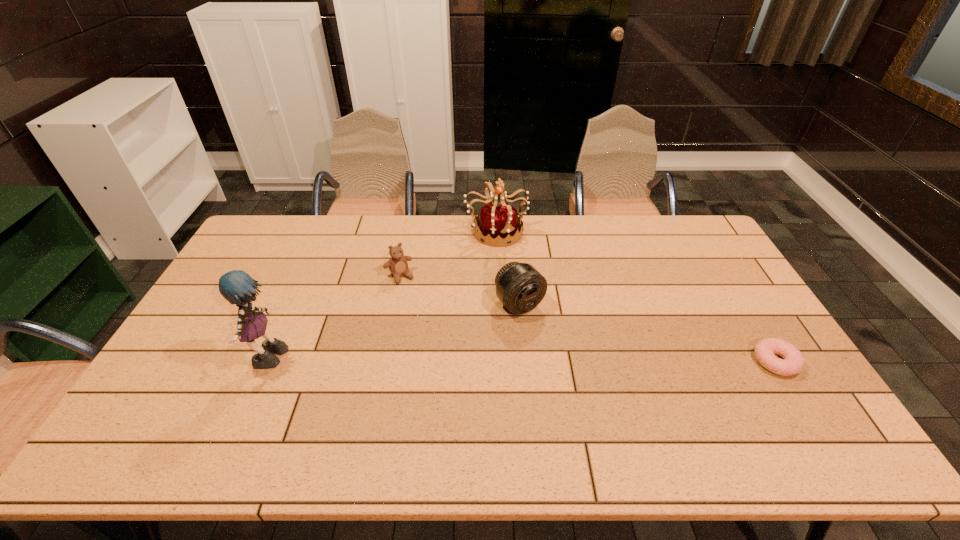
In order to click on rag doll in this screenshot , I will do `click(237, 287)`.

The image size is (960, 540). What are the coordinates of `the tallest object` in the screenshot? It's located at (237, 287).

Find the location of a particular element. The width and height of the screenshot is (960, 540). the shortest object is located at coordinates (793, 363).

I want to click on the rightmost object, so click(x=793, y=363).

Identify the location of the fourth object from right to left. This screenshot has height=540, width=960. (398, 265).

Identify the location of the second shortest object. The image size is (960, 540). (398, 265).

At what (x,y) coordinates should I click in order to perform the action: click on the third shortest object. Please return your answer as a coordinate pair (x, y). Looking at the image, I should click on (520, 287).

The width and height of the screenshot is (960, 540). What are the coordinates of `telephoto lens` in the screenshot? It's located at (520, 287).

The height and width of the screenshot is (540, 960). I want to click on the farthest object, so [502, 221].

Where is `tiara`? This screenshot has height=540, width=960. tiara is located at coordinates (502, 221).